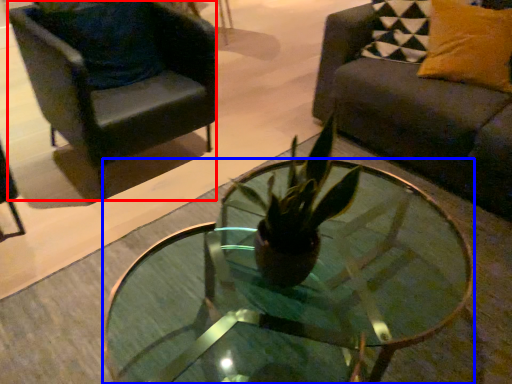
Question: Which point is further to the camera, chair (highlighted by a red box) or coffee table (highlighted by a blue box)?

Choices:
 (A) chair
 (B) coffee table

Answer: (A)